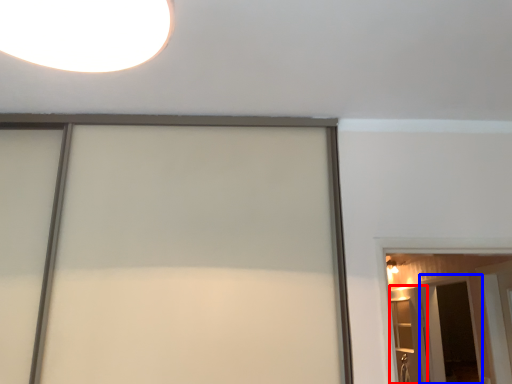
Question: Which object is closer to the camera taking this photo, elevator (highlighted by a red box) or screen door (highlighted by a blue box)?

Choices:
 (A) elevator
 (B) screen door

Answer: (A)